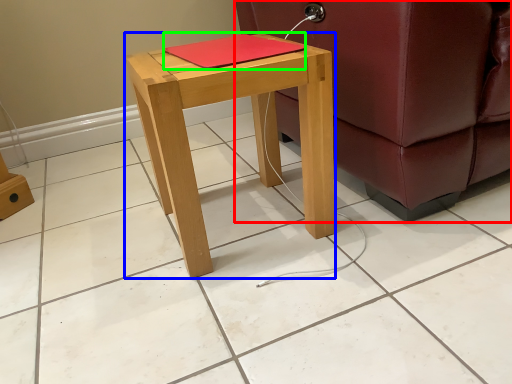
Question: Which object is the farthest from studio couch (highlighted by a red box)? Choose among these: stool (highlighted by a blue box) or notebook (highlighted by a green box).

Choices:
 (A) stool
 (B) notebook

Answer: (B)